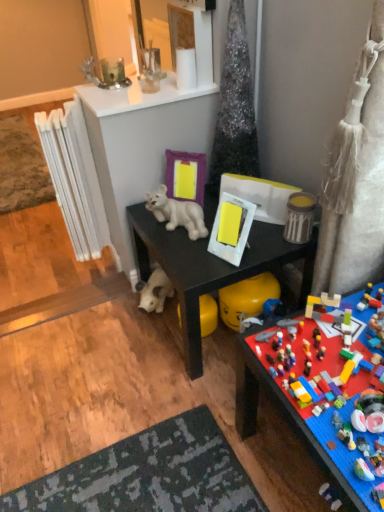
Locate an element on the screen. The image size is (384, 512). vacant space to the left of metallic silver canister at upper right, acting as the 3th toy starting from the bottom is located at coordinates (273, 232).